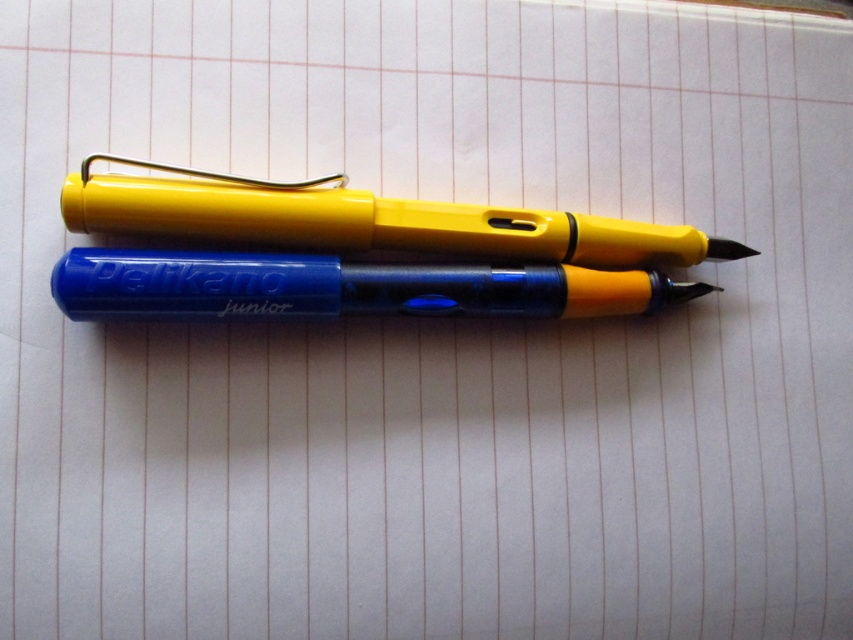
From the picture: You are organizing a stationery store display and need to arrange the yellow plastic pen at center and the blue translucent pen at center according to their positions. Which pen is located to the left of the other?

The blue translucent pen at center is located to the left of the yellow plastic pen at center because the yellow plastic pen at center is positioned on the right side of the blue translucent pen at center.